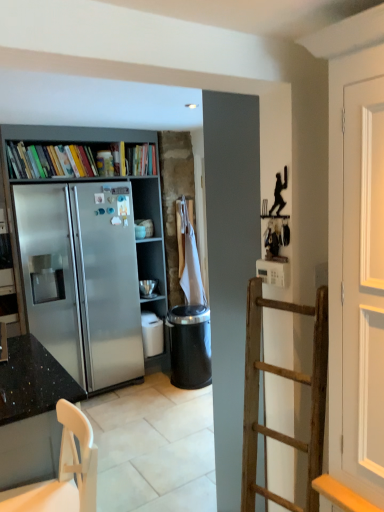
At what (x,y) coordinates should I click in order to perform the action: click on black plastic trash can at center. Please return your answer as a coordinate pair (x, y). The image size is (384, 512). Looking at the image, I should click on (190, 346).

This screenshot has height=512, width=384. Describe the element at coordinates (64, 472) in the screenshot. I see `white plastic chair at lower left` at that location.

Measure the distance between point (86,446) and camera.

Point (86,446) is 1.35 meters from camera.

What is the approximate width of multicolored paperbacks at upper left?

multicolored paperbacks at upper left is 10.84 inches wide.

What is the approximate width of granite black countertop at left?

granite black countertop at left is 3.30 feet wide.

This screenshot has width=384, height=512. I want to click on black plastic trash can at center, so click(190, 346).

Is black plastic trash can at center smaller than multicolored paperbacks at upper left?

No, black plastic trash can at center is not smaller than multicolored paperbacks at upper left.

Between black plastic trash can at center and multicolored paperbacks at upper left, which one has smaller width?

Thinner between the two is multicolored paperbacks at upper left.

Is black plastic trash can at center further to camera compared to multicolored paperbacks at upper left?

Yes, the depth of black plastic trash can at center is greater than that of multicolored paperbacks at upper left.

You are a GUI agent. You are given a task and a screenshot of the screen. Output one action in this format:
    pyautogui.click(x=<x>, y=<y>)
    Task: Click on the trash bin/can that is below the multicolored paperbacks at upper left (from the image's perspective)
    The height and width of the screenshot is (512, 384).
    Given the screenshot: What is the action you would take?
    tap(190, 346)

From a real-world perspective, which is physically below, satin silver bookcase at left or white plastic chair at lower left?

From a 3D spatial view, white plastic chair at lower left is below.

Find the location of a particular element. This screenshot has width=384, height=512. bookcase lying above the white plastic chair at lower left (from the image's perspective) is located at coordinates (132, 220).

Is satin silver bookcase at left facing towards white plastic chair at lower left?

Yes, satin silver bookcase at left is facing white plastic chair at lower left.

From the image's perspective, does satin silver bookcase at left appear higher than white plastic chair at lower left?

Yes.

Is satin silver bookcase at left not within black plastic trash can at center?

Yes.

Considering the positions of objects satin silver bookcase at left and black plastic trash can at center in the image provided, who is more to the right, satin silver bookcase at left or black plastic trash can at center?

black plastic trash can at center is more to the right.

Between satin silver bookcase at left and black plastic trash can at center, which one has more height?

With more height is satin silver bookcase at left.

Considering the sizes of satin silver bookcase at left and black plastic trash can at center in the image, is satin silver bookcase at left bigger or smaller than black plastic trash can at center?

In the image, satin silver bookcase at left appears to be larger than black plastic trash can at center.

From the image's perspective, is black plastic trash can at center located above granite black countertop at left?

Indeed, from the image's perspective, black plastic trash can at center is shown above granite black countertop at left.

Which of these two, black plastic trash can at center or granite black countertop at left, stands shorter?

black plastic trash can at center.

Looking at this image, which is correct: black plastic trash can at center is inside granite black countertop at left, or outside of it?

black plastic trash can at center cannot be found inside granite black countertop at left.

Considering the relative sizes of white plastic chair at lower left and granite black countertop at left in the image provided, is white plastic chair at lower left taller than granite black countertop at left?

No, white plastic chair at lower left is not taller than granite black countertop at left.

How distant is white plastic chair at lower left from granite black countertop at left?

white plastic chair at lower left and granite black countertop at left are 5.97 inches apart from each other.

Looking at their sizes, would you say white plastic chair at lower left is wider or thinner than granite black countertop at left?

Considering their sizes, white plastic chair at lower left looks slimmer than granite black countertop at left.

Which is in front, white plastic chair at lower left or granite black countertop at left?

white plastic chair at lower left is more forward.

Is satin silver bookcase at left located within black plastic trash can at center?

Actually, satin silver bookcase at left is outside black plastic trash can at center.

In the scene shown: Considering the relative sizes of black plastic trash can at center and satin silver bookcase at left in the image provided, is black plastic trash can at center taller than satin silver bookcase at left?

In fact, black plastic trash can at center may be shorter than satin silver bookcase at left.

Looking at this image, does black plastic trash can at center have a larger size compared to satin silver bookcase at left?

Incorrect, black plastic trash can at center is not larger than satin silver bookcase at left.

Would you consider black plastic trash can at center to be distant from satin silver bookcase at left?

No, there isn't a large distance between black plastic trash can at center and satin silver bookcase at left.

From a real-world perspective, relative to satin silver bookcase at left, is white plastic chair at lower left vertically above or below?

Clearly, from a real-world perspective, white plastic chair at lower left is below satin silver bookcase at left.

Is white plastic chair at lower left oriented away from satin silver bookcase at left?

No, white plastic chair at lower left's orientation is not away from satin silver bookcase at left.

From the image's perspective, relative to satin silver bookcase at left, is white plastic chair at lower left above or below?

Clearly, from the image's perspective, white plastic chair at lower left is below satin silver bookcase at left.

Find the location of `bookcase above the white plastic chair at lower left (from the image's perspective)`. bookcase above the white plastic chair at lower left (from the image's perspective) is located at coordinates (132, 220).

In order to click on book in front of the black plastic trash can at center in this screenshot , I will do `click(80, 161)`.

At what (x,y) coordinates should I click in order to perform the action: click on chair that is on the right side of satin silver bookcase at left. Please return your answer as a coordinate pair (x, y). This screenshot has width=384, height=512. Looking at the image, I should click on (64, 472).

Based on the photo, considering their positions, is black plastic trash can at center positioned further to granite black countertop at left than multicolored paperbacks at upper left?

multicolored paperbacks at upper left.

From the image, which object appears to be farther from satin silver bookcase at left, multicolored paperbacks at upper left or black plastic trash can at center?

black plastic trash can at center lies further to satin silver bookcase at left than the other object.

When comparing their distances from multicolored paperbacks at upper left, does granite black countertop at left or black plastic trash can at center seem further?

granite black countertop at left lies further to multicolored paperbacks at upper left than the other object.

Estimate the real-world distances between objects in this image. Which object is further from granite black countertop at left, white plastic chair at lower left or black plastic trash can at center?

black plastic trash can at center is further to granite black countertop at left.

When comparing their distances from granite black countertop at left, does satin silver bookcase at left or multicolored paperbacks at upper left seem closer?

Among the two, satin silver bookcase at left is located nearer to granite black countertop at left.

Based on their spatial positions, is granite black countertop at left or black plastic trash can at center closer to satin silver bookcase at left?

The object closer to satin silver bookcase at left is black plastic trash can at center.

From the image, which object appears to be nearer to white plastic chair at lower left, satin silver bookcase at left or multicolored paperbacks at upper left?

satin silver bookcase at left lies closer to white plastic chair at lower left than the other object.

In the scene shown: Which object lies further to the anchor point granite black countertop at left, satin silver bookcase at left or black plastic trash can at center?

The object further to granite black countertop at left is satin silver bookcase at left.

Image resolution: width=384 pixels, height=512 pixels. What are the coordinates of `bookcase between white plastic chair at lower left and multicolored paperbacks at upper left along the z-axis` in the screenshot? It's located at (132, 220).

Image resolution: width=384 pixels, height=512 pixels. Find the location of `book located between granite black countertop at left and black plastic trash can at center in the depth direction`. book located between granite black countertop at left and black plastic trash can at center in the depth direction is located at coordinates (80, 161).

Image resolution: width=384 pixels, height=512 pixels. Identify the location of bookcase positioned between granite black countertop at left and black plastic trash can at center from near to far. (132, 220).

The image size is (384, 512). What are the coordinates of `bookcase that lies between multicolored paperbacks at upper left and black plastic trash can at center from top to bottom` in the screenshot? It's located at (132, 220).